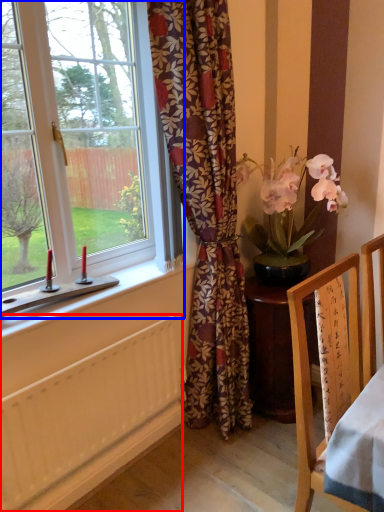
Question: Which object is closer to the camera taking this photo, radiator (highlighted by a red box) or window (highlighted by a blue box)?

Choices:
 (A) radiator
 (B) window

Answer: (B)